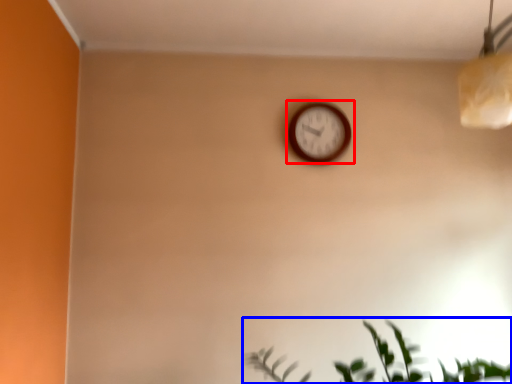
Question: Which object is further to the camera taking this photo, wall clock (highlighted by a red box) or houseplant (highlighted by a blue box)?

Choices:
 (A) wall clock
 (B) houseplant

Answer: (A)